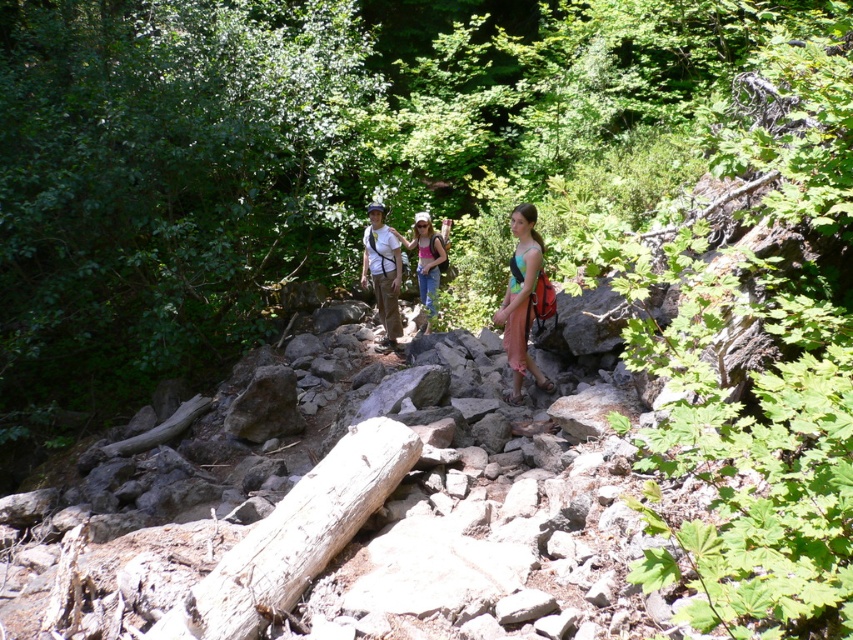
Who is more distant from viewer, (521, 291) or (426, 237)?

The point (426, 237) is more distant.

Which is in front, point (518, 310) or point (410, 243)?

Point (518, 310) is in front.

This screenshot has height=640, width=853. Describe the element at coordinates (521, 300) in the screenshot. I see `multicolored fabric dress at center` at that location.

At what (x,y) coordinates should I click in order to perform the action: click on multicolored fabric dress at center. Please return your answer as a coordinate pair (x, y). Looking at the image, I should click on (521, 300).